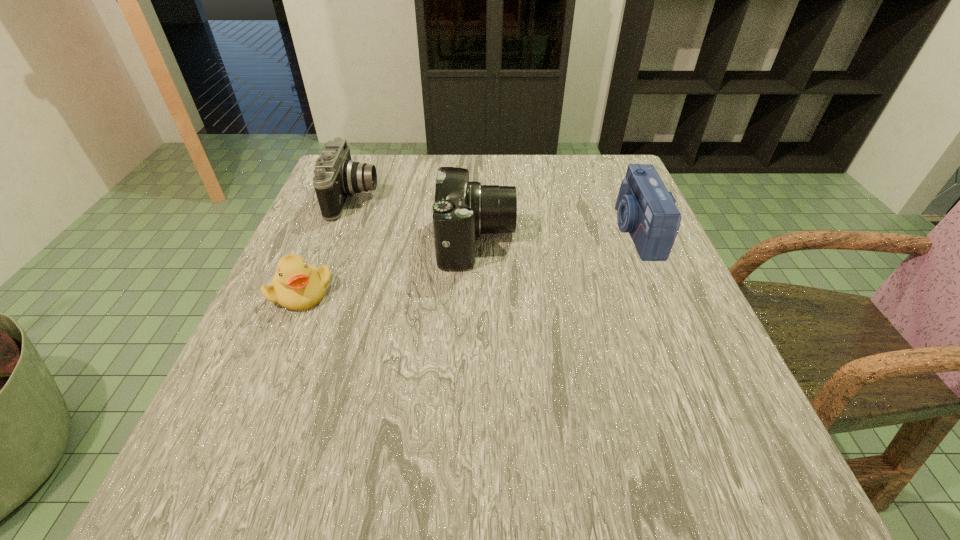
Where is `the second camera from right to left`? The width and height of the screenshot is (960, 540). the second camera from right to left is located at coordinates (462, 210).

Locate an element on the screen. the leftmost camera is located at coordinates (336, 177).

Find the location of a particular element. the rightmost camera is located at coordinates (646, 210).

Locate an element on the screen. This screenshot has height=540, width=960. duckling is located at coordinates (297, 285).

The width and height of the screenshot is (960, 540). I want to click on vacant space located on the lens of the second camera from right to left, so click(x=636, y=241).

Locate an element on the screen. The height and width of the screenshot is (540, 960). free space located on the front-facing side of the leftmost camera is located at coordinates (548, 198).

At what (x,y) coordinates should I click in order to perform the action: click on blank area located 0.280m on the lens of the rightmost camera. Please return your answer as a coordinate pair (x, y). Looking at the image, I should click on (486, 231).

At what (x,y) coordinates should I click in order to perform the action: click on free space located 0.370m on the lens of the rightmost camera. Please return your answer as a coordinate pair (x, y). This screenshot has width=960, height=540. Looking at the image, I should click on (444, 231).

The width and height of the screenshot is (960, 540). Find the location of `vacant space located 0.250m on the lens of the rightmost camera`. vacant space located 0.250m on the lens of the rightmost camera is located at coordinates (500, 231).

In order to click on free space located on the beak of the duckling in this screenshot , I will do `click(281, 341)`.